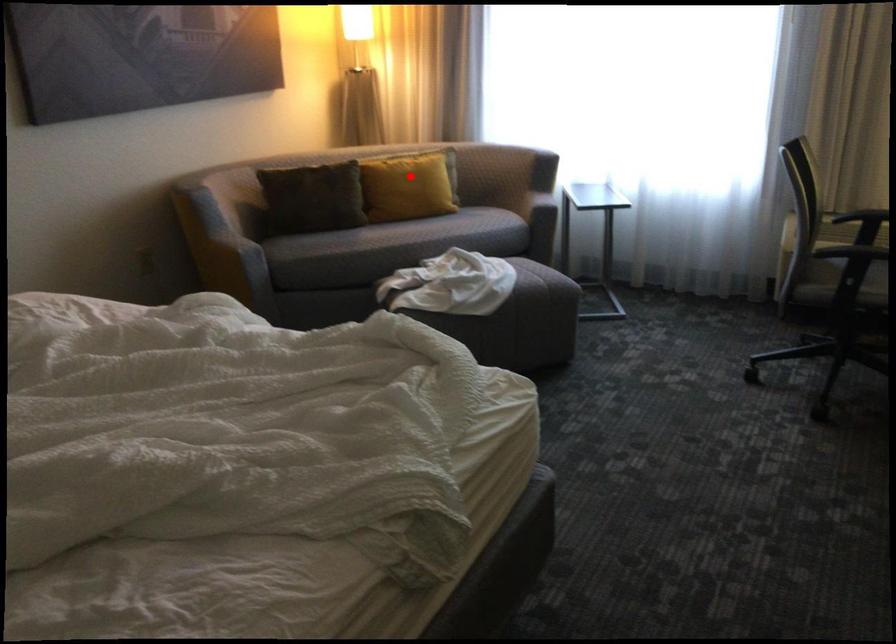
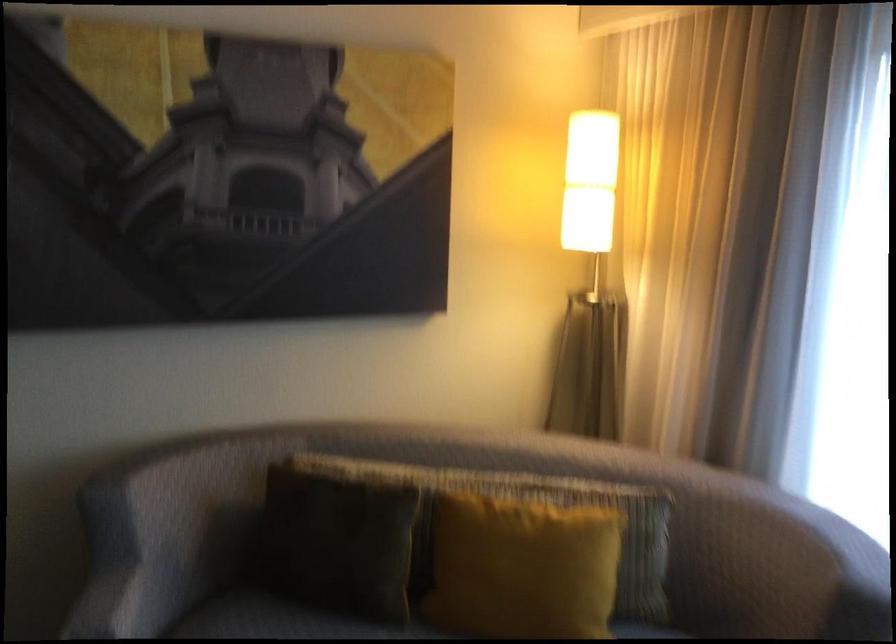
In the second image, find the point that corresponds to the highlighted location in the first image.

(522, 567)